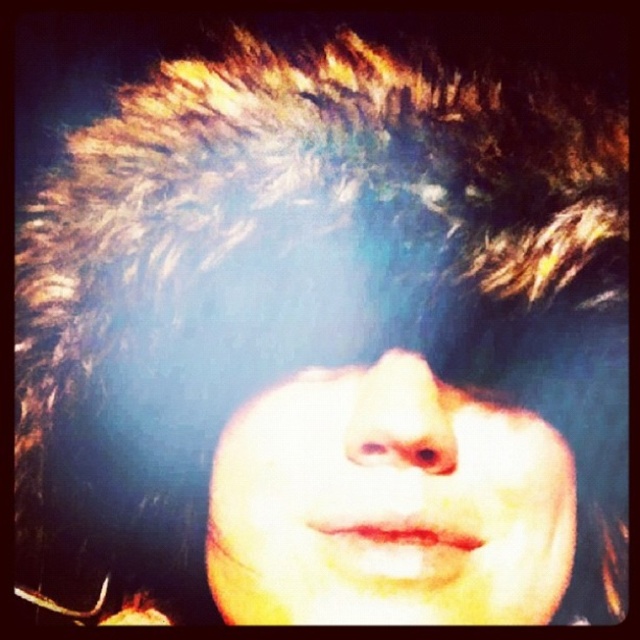
Question: Which point is farther to the camera?

Choices:
 (A) brown matte eye at center
 (B) smooth skin face at center

Answer: (A)

Question: Is smooth skin face at center wider than brown matte eye at center?

Choices:
 (A) yes
 (B) no

Answer: (A)

Question: Among these points, which one is nearest to the camera?

Choices:
 (A) (241, 506)
 (B) (356, 376)

Answer: (B)

Question: Is smooth skin face at center positioned in front of brown matte eye at center?

Choices:
 (A) yes
 (B) no

Answer: (A)

Question: Is smooth skin face at center closer to camera compared to brown matte eye at center?

Choices:
 (A) no
 (B) yes

Answer: (B)